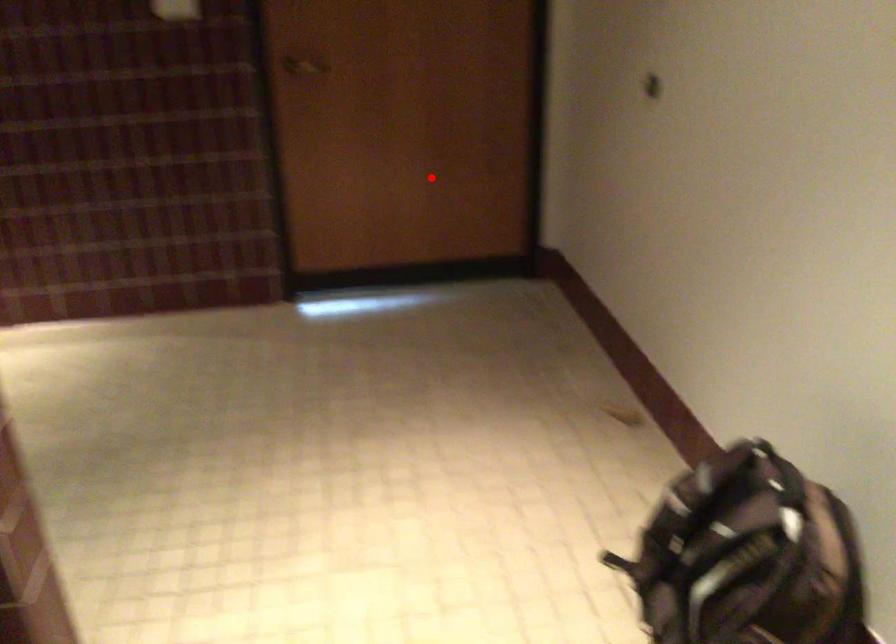
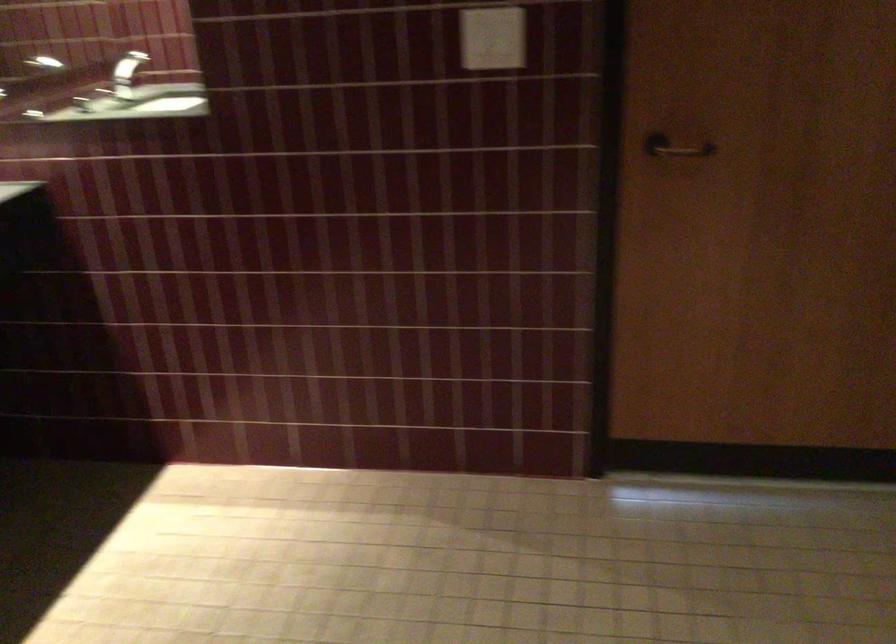
Where in the second image is the point corresponding to the highlighted location from the first image?

(857, 321)